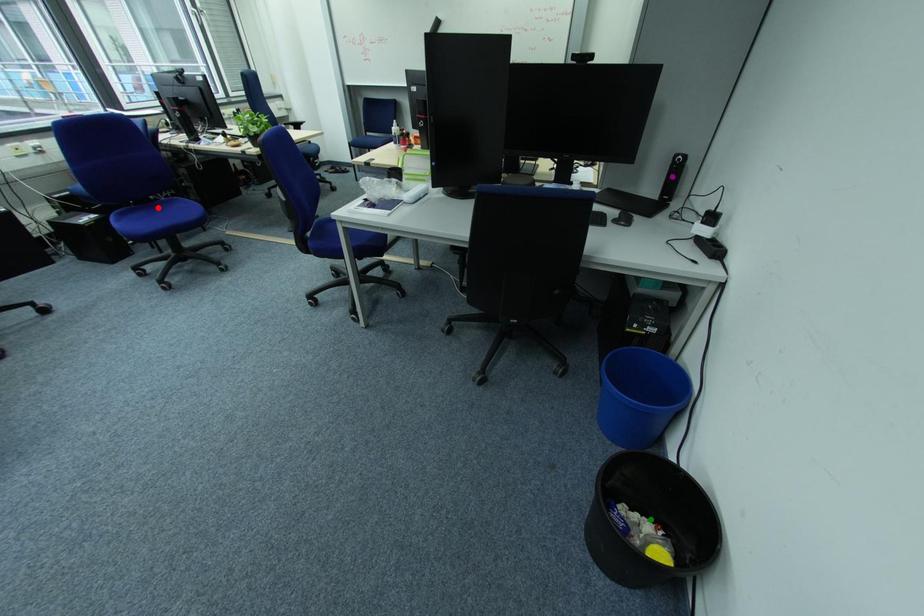
Order these from nearest to farthest:
purple point | red point | green point

green point → purple point → red point